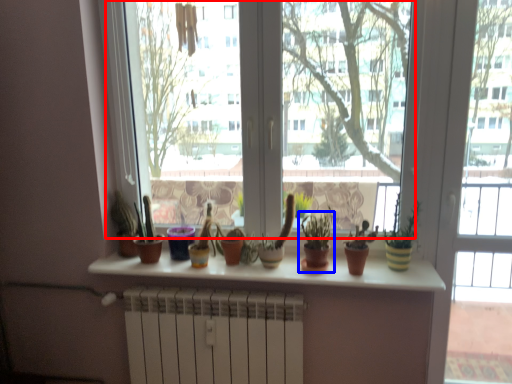
Question: Which of the following is the farthest to the observer, window screen (highlighted by a red box) or houseplant (highlighted by a blue box)?

Choices:
 (A) window screen
 (B) houseplant

Answer: (B)